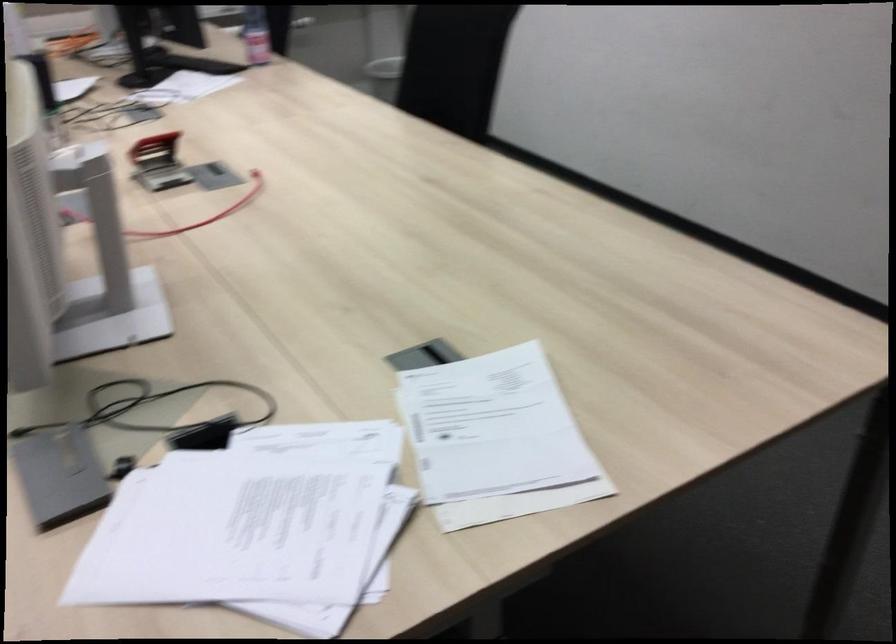
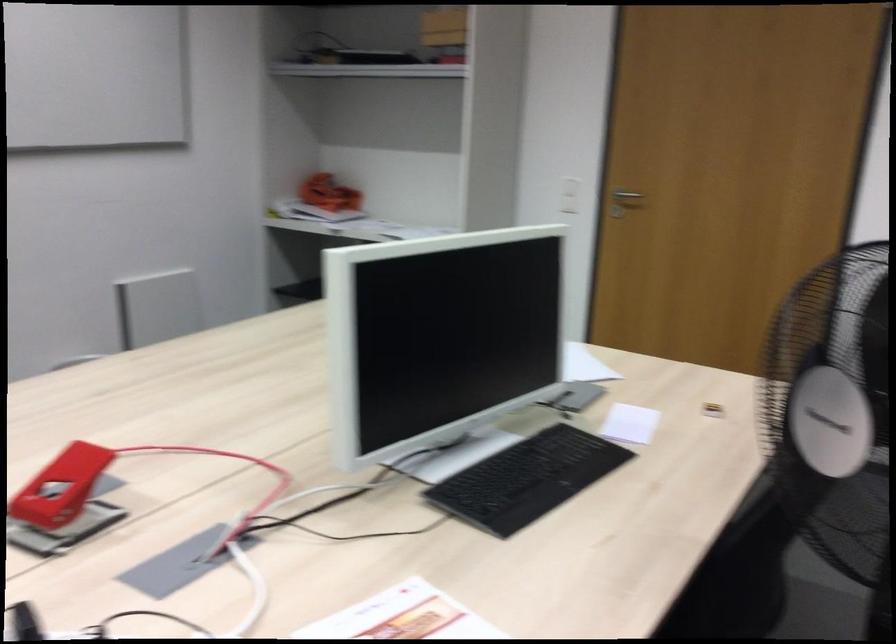
The point at [243,184] is marked in the first image. Where is the corresponding point in the second image?

(101, 494)